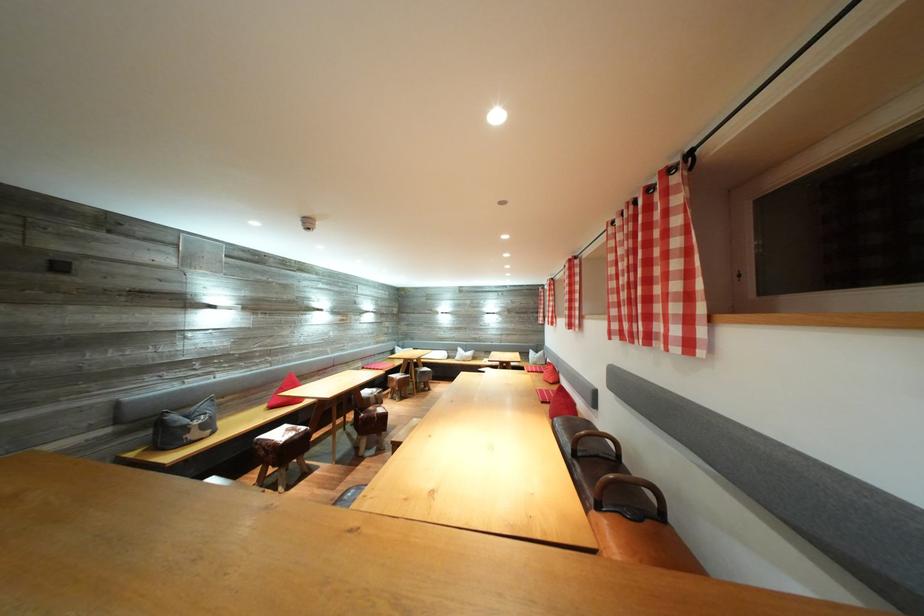
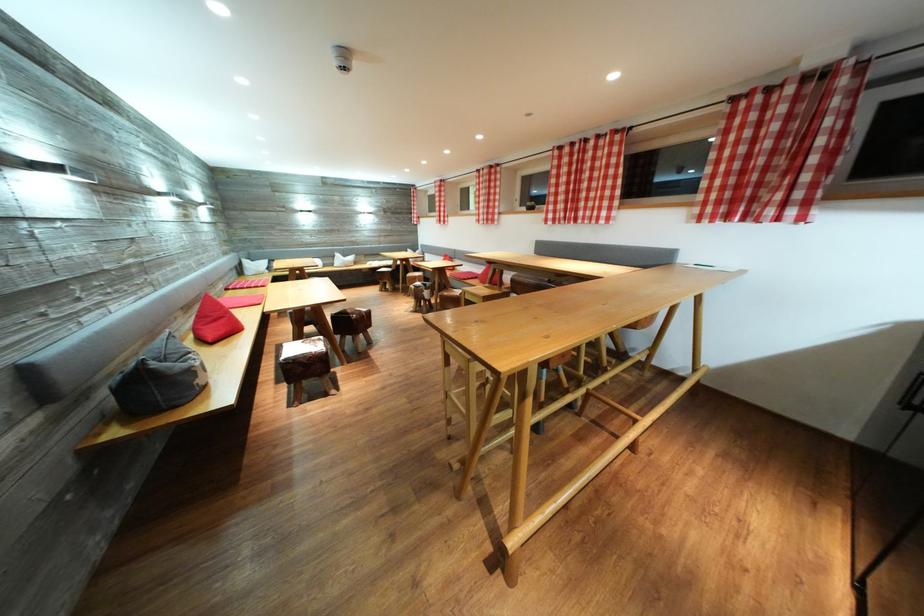
The point at (299, 435) is marked in the first image. Where is the corresponding point in the second image?

(321, 346)